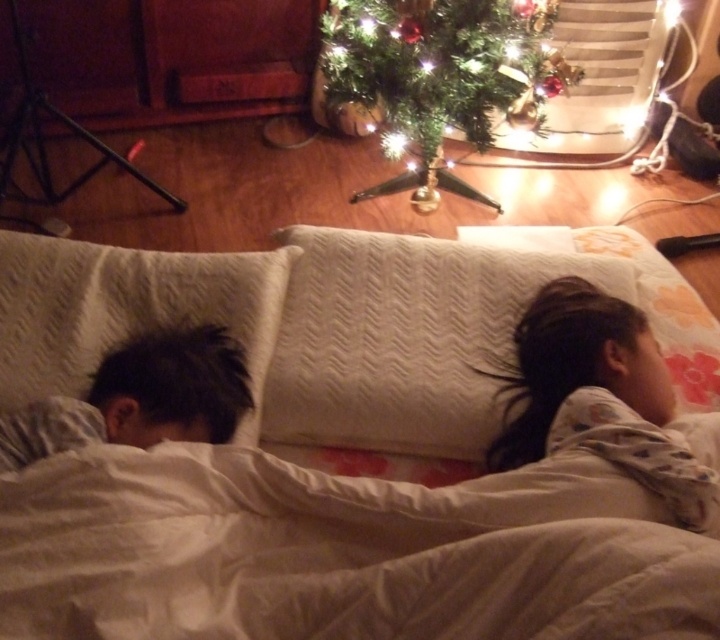
Question: Considering the real-world distances, which object is closest to the white soft bed at center?

Choices:
 (A) green textured christmas tree at upper center
 (B) dark brown hair at left
 (C) white textured pillow at left

Answer: (C)

Question: Which point is farther to the camera?

Choices:
 (A) (184, 435)
 (B) (652, 333)
 (C) (138, 266)
 (D) (287, 360)

Answer: (C)

Question: Considering the relative positions of white soft bed at center and white textured pillow at center in the image provided, where is white soft bed at center located with respect to white textured pillow at center?

Choices:
 (A) above
 (B) below

Answer: (B)

Question: Based on their relative distances, which object is nearer to the light brown hair at right?

Choices:
 (A) white textured pillow at center
 (B) white soft bed at center
 (C) white textured pillow at left
 (D) green textured christmas tree at upper center

Answer: (A)

Question: Can you confirm if white textured pillow at left is smaller than dark brown hair at left?

Choices:
 (A) yes
 (B) no

Answer: (B)

Question: Does white textured pillow at left appear over light brown hair at right?

Choices:
 (A) no
 (B) yes

Answer: (B)